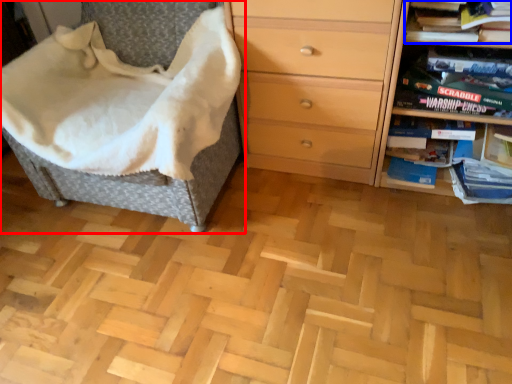
Question: Which point is further to the camera, furniture (highlighted by a red box) or book (highlighted by a blue box)?

Choices:
 (A) furniture
 (B) book

Answer: (B)